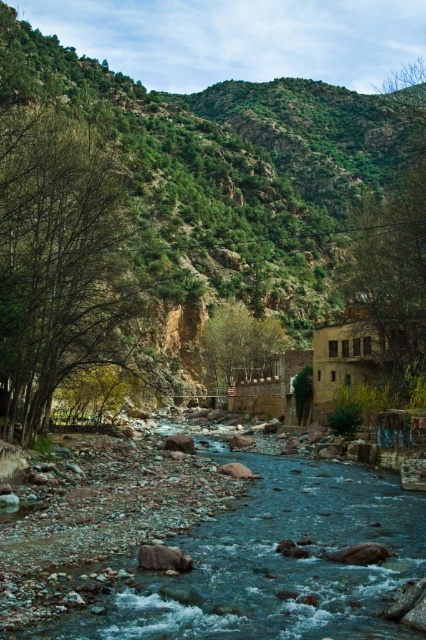
You are standing at the origin point of the image. Where is the smooth rock stream at center located in terms of its 2D coordinates?

The smooth rock stream at center is located at the 2D coordinates of point (273, 563).

You are standing at the point with coordinates point (17, 280) and want to walk towards the point with coordinates point (262, 364). Which direction should you face to move towards your destination?

You should face towards the direction of point (262, 364), which is behind point (17, 280) since point (17, 280) is in front of point (262, 364).

Based on the photo, you are standing at point A at the point marked as point (290, 234). You want to cross the river to reach the rustic buildings on the right. The river is flowing at a speed of 3 feet per second. If you can swim at 4 feet per second in still water, what is the minimum time required to reach the buildings?

The minimum time required to reach the buildings is 171.695 seconds. This is calculated by dividing the distance between point A and the buildings, which is 686.78 feet, by your swimming speed of 4 feet per second. The river current does not affect the time as you can adjust your swimming direction to counteract it, resulting in a straight path.